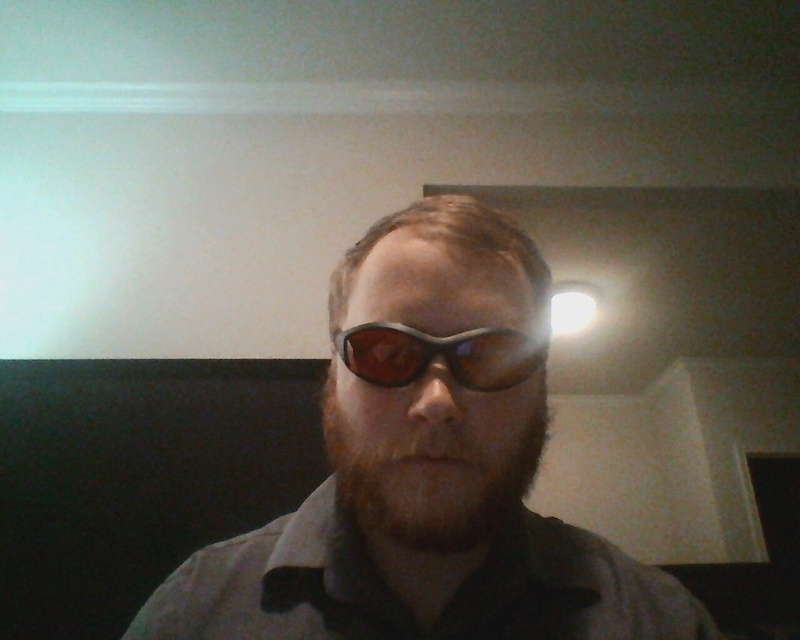
Who is shorter, brown fuzzy beard at center or matte black goggles at center?

Standing shorter between the two is matte black goggles at center.

Is brown fuzzy beard at center to the left of matte black goggles at center from the viewer's perspective?

Indeed, brown fuzzy beard at center is positioned on the left side of matte black goggles at center.

Is point (536, 428) closer to viewer compared to point (496, 362)?

No, (536, 428) is further to viewer.

Locate an element on the screen. This screenshot has height=640, width=800. brown fuzzy beard at center is located at coordinates (434, 474).

Consider the image. Does matte black sunglasses at center have a greater height compared to matte black goggles at center?

Indeed, matte black sunglasses at center has a greater height compared to matte black goggles at center.

Is matte black sunglasses at center positioned behind matte black goggles at center?

No.

Is point (408, 412) less distant than point (405, 349)?

Yes, point (408, 412) is in front of point (405, 349).

The image size is (800, 640). Identify the location of matte black sunglasses at center. (428, 470).

Is point (416, 460) closer to camera compared to point (398, 525)?

Yes.

Find the location of a particular element. This screenshot has height=640, width=800. matte black sunglasses at center is located at coordinates (428, 470).

Find the location of a particular element. Image resolution: width=800 pixels, height=640 pixels. matte black sunglasses at center is located at coordinates 428,470.

Identify the location of matte black sunglasses at center. (428, 470).